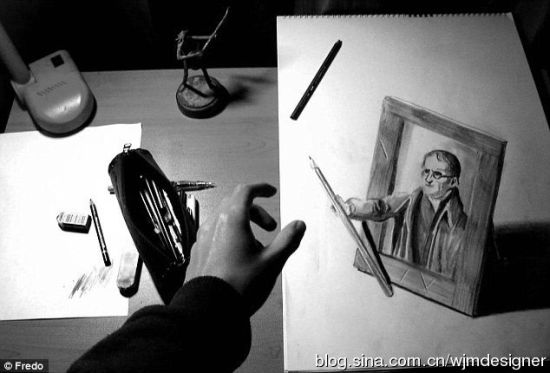
Locate an element on the screen. The width and height of the screenshot is (550, 373). lamp base is located at coordinates (41, 97).